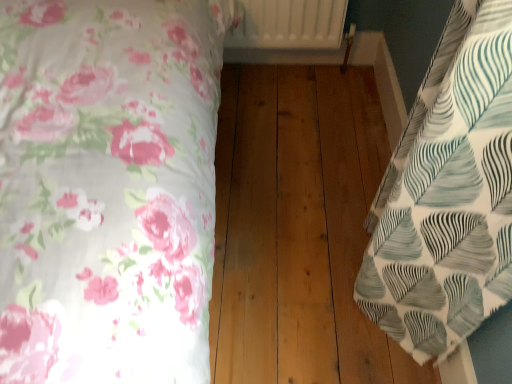
Question: Is the depth of white textured fabric at right, which is counted as the first bed, starting from the right, greater than that of white floral fabric at left, which appears as the 2th bed when viewed from the right?

Choices:
 (A) yes
 (B) no

Answer: (A)

Question: Does white textured fabric at right, the second bed when ordered from left to right, have a lesser width compared to white floral fabric at left, acting as the first bed starting from the left?

Choices:
 (A) no
 (B) yes

Answer: (B)

Question: From a real-world perspective, is white textured fabric at right, which is counted as the first bed, starting from the right, physically below white floral fabric at left, acting as the first bed starting from the left?

Choices:
 (A) no
 (B) yes

Answer: (B)

Question: From the image's perspective, would you say white textured fabric at right, the second bed when ordered from left to right, is shown under white floral fabric at left, acting as the first bed starting from the left?

Choices:
 (A) yes
 (B) no

Answer: (A)

Question: Is the position of white textured fabric at right, which is counted as the first bed, starting from the right, less distant than that of white floral fabric at left, which appears as the 2th bed when viewed from the right?

Choices:
 (A) no
 (B) yes

Answer: (A)

Question: From the image's perspective, is white floral fabric at left, which appears as the 2th bed when viewed from the right, above or below natural wood floor at center?

Choices:
 (A) below
 (B) above

Answer: (B)

Question: Is white floral fabric at left, which appears as the 2th bed when viewed from the right, wider or thinner than natural wood floor at center?

Choices:
 (A) thin
 (B) wide

Answer: (A)

Question: From a real-world perspective, is white floral fabric at left, which appears as the 2th bed when viewed from the right, positioned above or below natural wood floor at center?

Choices:
 (A) below
 (B) above

Answer: (B)

Question: In the image, is white floral fabric at left, which appears as the 2th bed when viewed from the right, on the left side or the right side of natural wood floor at center?

Choices:
 (A) left
 (B) right

Answer: (A)

Question: In terms of size, does natural wood floor at center appear bigger or smaller than white textured fabric at right, which is counted as the first bed, starting from the right?

Choices:
 (A) small
 (B) big

Answer: (B)

Question: Considering the positions of natural wood floor at center and white textured fabric at right, the second bed when ordered from left to right, in the image, is natural wood floor at center wider or thinner than white textured fabric at right, the second bed when ordered from left to right,?

Choices:
 (A) thin
 (B) wide

Answer: (B)

Question: From a real-world perspective, is natural wood floor at center physically located above or below white textured fabric at right, which is counted as the first bed, starting from the right?

Choices:
 (A) above
 (B) below

Answer: (B)

Question: Considering the positions of natural wood floor at center and white textured fabric at right, the second bed when ordered from left to right, in the image, is natural wood floor at center taller or shorter than white textured fabric at right, the second bed when ordered from left to right,?

Choices:
 (A) tall
 (B) short

Answer: (B)

Question: Considering the positions of white textured fabric at right, which is counted as the first bed, starting from the right, and white floral fabric at left, which appears as the 2th bed when viewed from the right, in the image, is white textured fabric at right, which is counted as the first bed, starting from the right, taller or shorter than white floral fabric at left, which appears as the 2th bed when viewed from the right,?

Choices:
 (A) tall
 (B) short

Answer: (B)

Question: Is white textured fabric at right, which is counted as the first bed, starting from the right, inside the boundaries of white floral fabric at left, acting as the first bed starting from the left, or outside?

Choices:
 (A) outside
 (B) inside

Answer: (A)